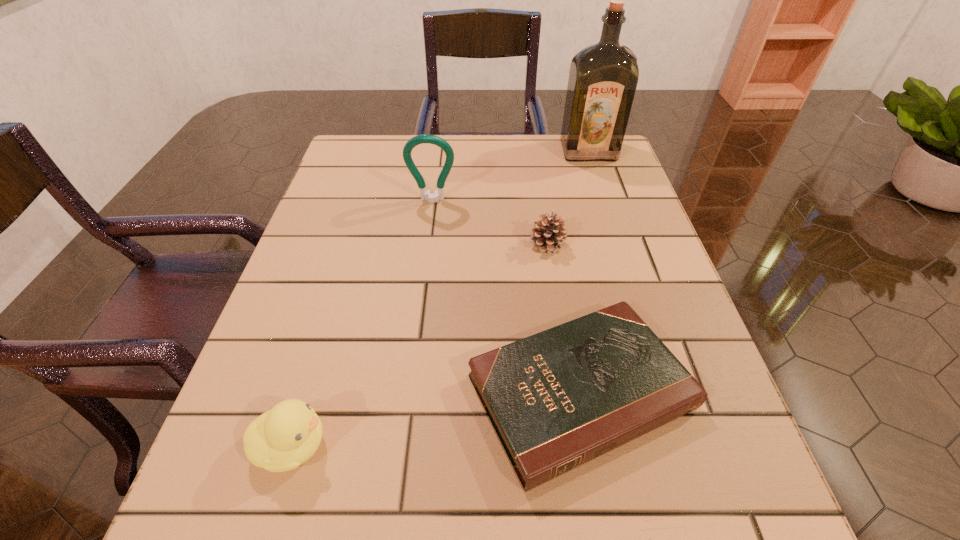
The width and height of the screenshot is (960, 540). I want to click on vacant space in between the leftmost object and the tallest object, so click(x=441, y=298).

Locate an element on the screen. The width and height of the screenshot is (960, 540). empty location between the third farthest object and the farthest object is located at coordinates (567, 198).

Where is `free space between the farthest object and the leftmost object`? The width and height of the screenshot is (960, 540). free space between the farthest object and the leftmost object is located at coordinates (441, 298).

This screenshot has height=540, width=960. I want to click on vacant point located between the bottle opener and the pinecone, so coord(490,222).

You are a GUI agent. You are given a task and a screenshot of the screen. Output one action in this format:
    pyautogui.click(x=<x>, y=<y>)
    Task: Click on the free space between the duckling and the fourth tallest object
    Image resolution: width=960 pixels, height=540 pixels.
    Given the screenshot: What is the action you would take?
    pyautogui.click(x=420, y=345)

At what (x,y) coordinates should I click in order to perform the action: click on vacant space that's between the tallest object and the third nearest object. Please return your answer as a coordinate pair (x, y). The width and height of the screenshot is (960, 540). Looking at the image, I should click on (567, 198).

Identify which object is located as the nearest to the pinecone. Please provide its 2D coordinates. Your answer should be formatted as a tuple, i.e. [(x, y)], where the tuple contains the x and y coordinates of a point satisfying the conditions above.

[(558, 399)]

Where is `object that is the second nearest to the duckling`? object that is the second nearest to the duckling is located at coordinates (546, 235).

This screenshot has width=960, height=540. Find the location of `free space that satisfies the following two spatial constraints: 1. on the front side of the fourth tallest object; 2. at the beak of the leftmost object`. free space that satisfies the following two spatial constraints: 1. on the front side of the fourth tallest object; 2. at the beak of the leftmost object is located at coordinates (579, 446).

The image size is (960, 540). In order to click on free spot that satisfies the following two spatial constraints: 1. at the jaws of the Bible; 2. on the right side of the bottle opener in this screenshot , I will do `click(408, 392)`.